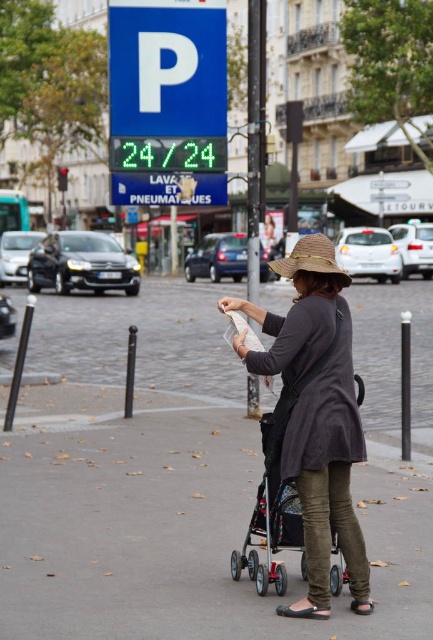
Question: Which object is closer to the camera taking this photo?

Choices:
 (A) smooth concrete pavement at center
 (B) metallic silver baby carriage at center
 (C) brown straw hat at center
 (D) matte gray coat at center

Answer: (D)

Question: Which of the following is the closest to the observer?

Choices:
 (A) metallic silver baby carriage at center
 (B) smooth concrete pavement at center
 (C) matte gray coat at center
 (D) brown straw hat at center

Answer: (C)

Question: Which object is farther from the camera taking this photo?

Choices:
 (A) matte gray coat at center
 (B) smooth concrete pavement at center

Answer: (B)

Question: Does metallic silver baby carriage at center appear over brown straw hat at center?

Choices:
 (A) no
 (B) yes

Answer: (A)

Question: Does smooth concrete pavement at center have a smaller size compared to brown straw hat at center?

Choices:
 (A) yes
 (B) no

Answer: (A)

Question: Does smooth concrete pavement at center appear on the left side of brown straw hat at center?

Choices:
 (A) yes
 (B) no

Answer: (A)